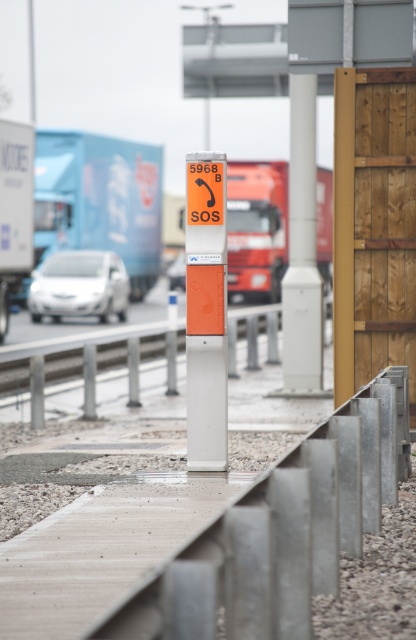
Which is in front, point (79, 308) or point (171, 275)?

Positioned in front is point (79, 308).

Can you confirm if white glossy car at left is smaller than matte white car at center?

Yes, white glossy car at left is smaller than matte white car at center.

Is point (99, 316) less distant than point (185, 273)?

No, it is behind (185, 273).

At what (x,y) coordinates should I click in order to perform the action: click on white glossy car at left. Please return your answer as a coordinate pair (x, y). Looking at the image, I should click on (79, 285).

Can you confirm if orange matte sign at center is positioned to the left of matte white car at center?

Incorrect, orange matte sign at center is not on the left side of matte white car at center.

Which is in front, point (217, 289) or point (168, 280)?

Point (217, 289) is more forward.

The image size is (416, 640). In order to click on orange matte sign at center in this screenshot , I will do `click(205, 312)`.

Which of these two, orange matte sign at center or orange plastic train track at center, stands shorter?

Standing shorter between the two is orange plastic train track at center.

From the picture: Is orange matte sign at center further to camera compared to orange plastic train track at center?

That is False.

Does point (208, 268) come in front of point (78, 385)?

Yes, point (208, 268) is closer to viewer.

You are a GUI agent. You are given a task and a screenshot of the screen. Output one action in this format:
    pyautogui.click(x=<x>, y=<y>)
    Task: Click on the orange matte sign at center
    Image resolution: width=416 pixels, height=640 pixels.
    Given the screenshot: What is the action you would take?
    pyautogui.click(x=205, y=312)